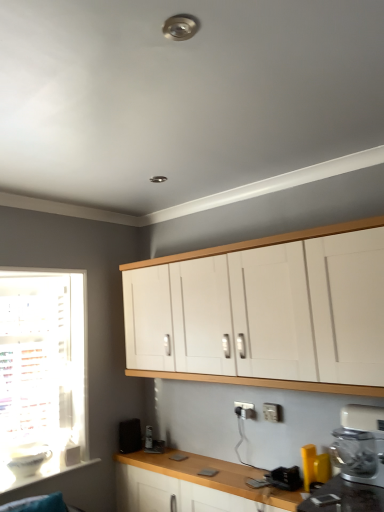
What do you see at coordinates (28, 459) in the screenshot? This screenshot has height=512, width=384. I see `white glossy bowl at lower left, which is the third appliance from front to back` at bounding box center [28, 459].

Describe the element at coordinates (264, 312) in the screenshot. I see `white matte cabinet at upper center` at that location.

Identify the location of wooden at lower center. (182, 483).

Image resolution: width=384 pixels, height=512 pixels. What do you see at coordinates (51, 480) in the screenshot?
I see `white plastic window sill at lower left` at bounding box center [51, 480].

The width and height of the screenshot is (384, 512). Find the location of `yellow plastic spatula at lower right, the first appliance from the front`. yellow plastic spatula at lower right, the first appliance from the front is located at coordinates (314, 466).

Which object is further away from the camera taking this photo, white matte cabinet at upper center or white plastic electric outlet at lower center?

white plastic electric outlet at lower center is more distant.

What's the angular difference between white matte cabinet at upper center and white plastic electric outlet at lower center's facing directions?

white matte cabinet at upper center and white plastic electric outlet at lower center are facing 1.49 degrees away from each other.

From a real-world perspective, which object stands above the other?

From a 3D spatial view, white matte cabinet at upper center is above.

Considering the relative sizes of white matte cabinet at upper center and white plastic electric outlet at lower center in the image provided, is white matte cabinet at upper center bigger than white plastic electric outlet at lower center?

Yes, white matte cabinet at upper center is bigger than white plastic electric outlet at lower center.

Between white plastic electric outlet at lower center and white matte cabinet at upper center, which one is positioned behind?

white plastic electric outlet at lower center is more distant.

Which of these two, white plastic electric outlet at lower center or white matte cabinet at upper center, is thinner?

white plastic electric outlet at lower center is thinner.

Is white plastic electric outlet at lower center at the right side of white matte cabinet at upper center?

Yes.

Does white plastic electric outlet at lower center have a larger size compared to white matte cabinet at upper center?

No, white plastic electric outlet at lower center is not bigger than white matte cabinet at upper center.

Is white plastic electric outlet at lower center bigger than white plastic window sill at lower left?

Actually, white plastic electric outlet at lower center might be smaller than white plastic window sill at lower left.

From a real-world perspective, is white plastic electric outlet at lower center physically below white plastic window sill at lower left?

No, from a real-world perspective, white plastic electric outlet at lower center is not under white plastic window sill at lower left.

Based on their positions, is white plastic electric outlet at lower center located to the left or right of white plastic window sill at lower left?

In the image, white plastic electric outlet at lower center appears on the right side of white plastic window sill at lower left.

Is metallic silver toaster at lower center, which ranks as the second appliance in left-to-right order, beside white plastic window sill at lower left?

No.

From the image's perspective, is metallic silver toaster at lower center, arranged as the second appliance when viewed from the front, located beneath white plastic window sill at lower left?

No, from the image's perspective, metallic silver toaster at lower center, arranged as the second appliance when viewed from the front, is not below white plastic window sill at lower left.

How far apart are metallic silver toaster at lower center, arranged as the second appliance when viewed from the front, and white plastic window sill at lower left?

metallic silver toaster at lower center, arranged as the second appliance when viewed from the front, and white plastic window sill at lower left are 1.39 meters apart from each other.

Between point (294, 482) and point (69, 477), which one is positioned in front?

Point (294, 482)

Which is behind, white matte cabinet at upper center or white plastic window sill at lower left?

Positioned behind is white plastic window sill at lower left.

Can you see white matte cabinet at upper center touching white plastic window sill at lower left?

white matte cabinet at upper center is not next to white plastic window sill at lower left, and they're not touching.

Considering the relative sizes of white matte cabinet at upper center and white plastic window sill at lower left in the image provided, is white matte cabinet at upper center shorter than white plastic window sill at lower left?

Incorrect, the height of white matte cabinet at upper center does not fall short of that of white plastic window sill at lower left.

Does white matte cabinet at upper center appear on the right side of white plastic window sill at lower left?

Correct, you'll find white matte cabinet at upper center to the right of white plastic window sill at lower left.

Who is taller, metallic silver toaster at lower center, arranged as the second appliance when viewed from the front, or white plastic mixer at lower right?

white plastic mixer at lower right.

From the image's perspective, which one is positioned lower, metallic silver toaster at lower center, the 2th appliance when ordered from back to front, or white plastic mixer at lower right?

metallic silver toaster at lower center, the 2th appliance when ordered from back to front.

How different are the orientations of metallic silver toaster at lower center, the second appliance positioned from the right, and white plastic mixer at lower right in degrees?

The angular difference between metallic silver toaster at lower center, the second appliance positioned from the right, and white plastic mixer at lower right is 1.33 degrees.

From a real-world perspective, is metallic silver toaster at lower center, the 2th appliance when ordered from back to front, physically above white plastic mixer at lower right?

No, from a real-world perspective, metallic silver toaster at lower center, the 2th appliance when ordered from back to front, is not over white plastic mixer at lower right

From the image's perspective, relative to white plastic electric outlet at lower center, is white plastic mixer at lower right above or below?

Based on their image positions, white plastic mixer at lower right is located above white plastic electric outlet at lower center.

At what (x,y) coordinates should I click in order to perform the action: click on electric outlet above the white plastic mixer at lower right (from a real-world perspective). Please return your answer as a coordinate pair (x, y). This screenshot has width=384, height=512. Looking at the image, I should click on pyautogui.click(x=272, y=412).

Is white plastic electric outlet at lower center at the back of white plastic mixer at lower right?

No.

Consider the image. Is white plastic mixer at lower right wider than white plastic electric outlet at lower center?

Yes, white plastic mixer at lower right is wider than white plastic electric outlet at lower center.

Identify the location of electric outlet located below the white matte cabinet at upper center (from the image's perspective). (272, 412).

Find the location of a particular element. The height and width of the screenshot is (512, 384). cabinetry above the white plastic electric outlet at lower center (from a real-world perspective) is located at coordinates (264, 312).

When comparing their distances from white glossy bowl at lower left, which is the third appliance from front to back, does white plastic mixer at lower right or yellow plastic spatula at lower right, positioned as the first appliance in right-to-left order, seem further?

white plastic mixer at lower right is positioned further to the anchor white glossy bowl at lower left, which is the third appliance from front to back.

Considering their positions, is white glossy bowl at lower left, placed as the 1th appliance when sorted from back to front, positioned closer to white plastic electric outlet at lower center than white plastic window sill at lower left?

white plastic window sill at lower left is closer to white plastic electric outlet at lower center.

From the image, which object appears to be farther from white plastic electric outlet at lower center, wooden at lower center or metallic silver toaster at lower center, which ranks as the second appliance in left-to-right order?

wooden at lower center is further to white plastic electric outlet at lower center.

From the image, which object appears to be farther from metallic silver toaster at lower center, arranged as the second appliance when viewed from the front, white plastic window sill at lower left or white plastic mixer at lower right?

Among the two, white plastic window sill at lower left is located further to metallic silver toaster at lower center, arranged as the second appliance when viewed from the front.

Estimate the real-world distances between objects in this image. Which object is closer to wooden at lower center, yellow plastic spatula at lower right, which ranks as the third appliance in left-to-right order, or white plastic window sill at lower left?

white plastic window sill at lower left.

Which object lies nearer to the anchor point white plastic electric outlet at lower center, wooden at lower center or white matte cabinet at upper center?

wooden at lower center is positioned closer to the anchor white plastic electric outlet at lower center.

Based on their spatial positions, is white plastic mixer at lower right or white plastic window sill at lower left further from yellow plastic spatula at lower right, which appears as the 3th appliance when viewed from the back?

white plastic window sill at lower left is positioned further to the anchor yellow plastic spatula at lower right, which appears as the 3th appliance when viewed from the back.

In the scene shown: Estimate the real-world distances between objects in this image. Which object is further from white plastic mixer at lower right, white glossy bowl at lower left, which appears as the first appliance when viewed from the left, or metallic silver toaster at lower center, which ranks as the second appliance in left-to-right order?

white glossy bowl at lower left, which appears as the first appliance when viewed from the left, is positioned further to the anchor white plastic mixer at lower right.

What are the coordinates of `appliance between wooden at lower center and yellow plastic spatula at lower right, which ranks as the third appliance in left-to-right order, from left to right` in the screenshot? It's located at (285, 478).

This screenshot has height=512, width=384. What are the coordinates of `kitchen appliance between white matte cabinet at upper center and yellow plastic spatula at lower right, which appears as the 3th appliance when viewed from the back, vertically` in the screenshot? It's located at (360, 444).

The width and height of the screenshot is (384, 512). What are the coordinates of `electric outlet situated between white plastic window sill at lower left and yellow plastic spatula at lower right, positioned as the first appliance in right-to-left order, from left to right` in the screenshot? It's located at tap(272, 412).

The image size is (384, 512). I want to click on electric outlet that lies between white matte cabinet at upper center and wooden at lower center from top to bottom, so click(x=272, y=412).